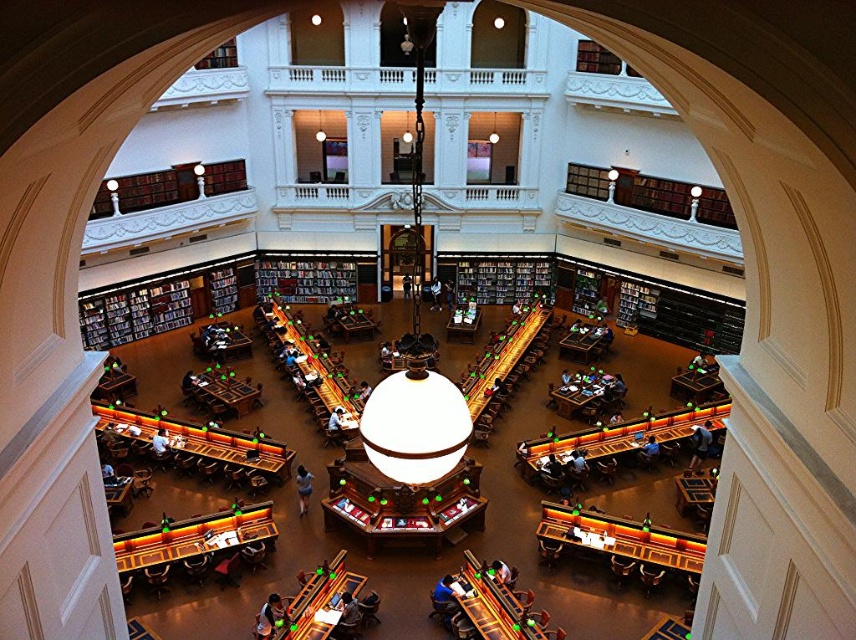
Can you confirm if wooden bookshelf at left is bigger than wooden bookshelf at center?

Yes.

What are the coordinates of `wooden bookshelf at left` in the screenshot? It's located at (162, 304).

Where is `wooden bookshelf at left`? Image resolution: width=856 pixels, height=640 pixels. wooden bookshelf at left is located at coordinates (162, 304).

Is point (477, 296) farther from viewer compared to point (336, 269)?

Yes, point (477, 296) is behind point (336, 269).

Which is more to the left, wooden bookshelf at center or dark wood bookshelf at center?

dark wood bookshelf at center

Find the location of a particular element. This screenshot has height=640, width=856. wooden bookshelf at center is located at coordinates (498, 276).

Where is `wooden bookshelf at center`? The image size is (856, 640). wooden bookshelf at center is located at coordinates (498, 276).

Which is above, wooden bookshelf at left or dark wood bookshelf at center?

dark wood bookshelf at center is above.

Is point (241, 280) less distant than point (263, 291)?

Yes, point (241, 280) is closer to viewer.

Locate an element on the screen. This screenshot has height=640, width=856. wooden bookshelf at left is located at coordinates (162, 304).